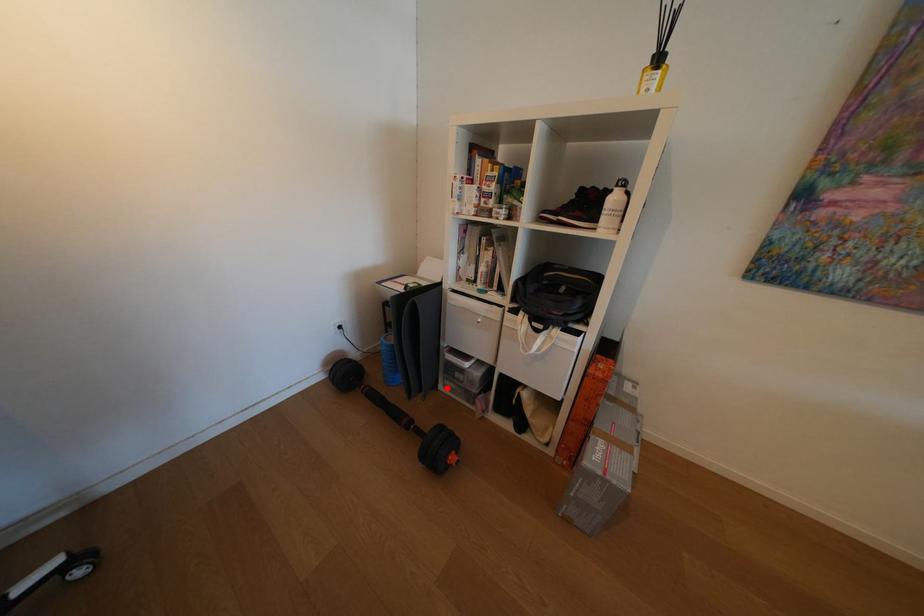
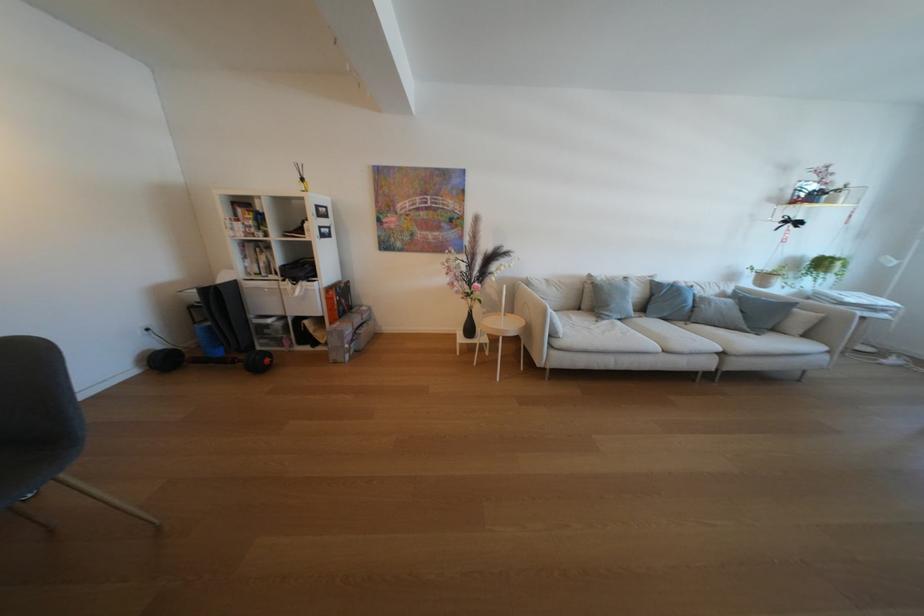
Locate, in the second image, the point that corresponds to the highlighted location in the first image.

(265, 351)